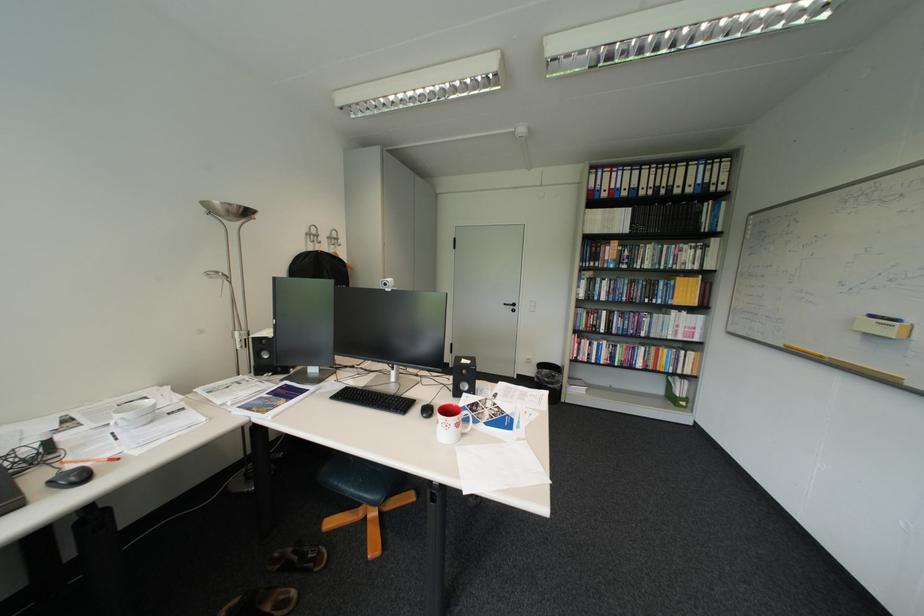
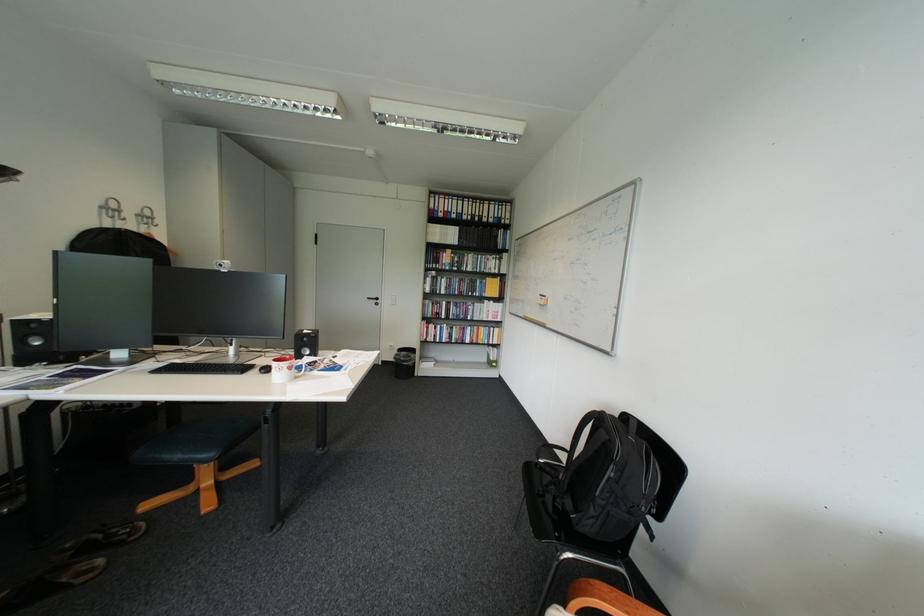
Where in the second image is the point corresponding to the point at 442,413 from the first image?

(281, 370)